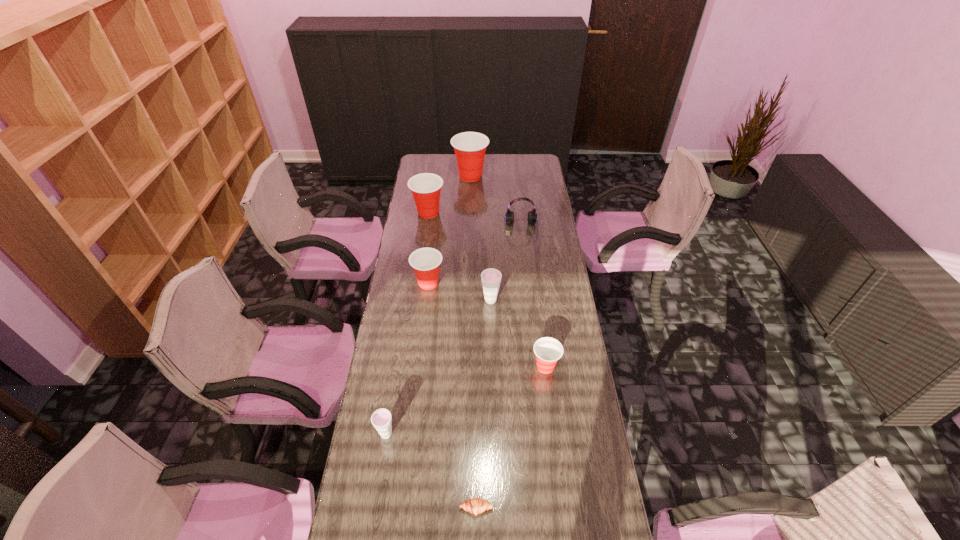
Identify the location of the farthest cup. (469, 147).

This screenshot has width=960, height=540. I want to click on the biggest red cup, so click(469, 147).

Find the location of a particular element. The image size is (960, 540). the third smallest red cup is located at coordinates (425, 187).

Where is `the seventh shortest object`? The image size is (960, 540). the seventh shortest object is located at coordinates (425, 187).

Identify the location of headset. (532, 216).

I want to click on the second smallest red cup, so click(x=425, y=261).

You are a GUI agent. You are given a task and a screenshot of the screen. Output one action in this format:
    pyautogui.click(x=<x>, y=<y>)
    Task: Click on the bigger purple cup
    This screenshot has width=960, height=540.
    Given the screenshot: What is the action you would take?
    point(491,278)

Find the location of a particular element. the right purple cup is located at coordinates (491, 278).

What are the coordinates of `the rightmost cup` in the screenshot? It's located at (548, 350).

This screenshot has height=540, width=960. What are the coordinates of `the fifth farthest cup` in the screenshot? It's located at (548, 350).